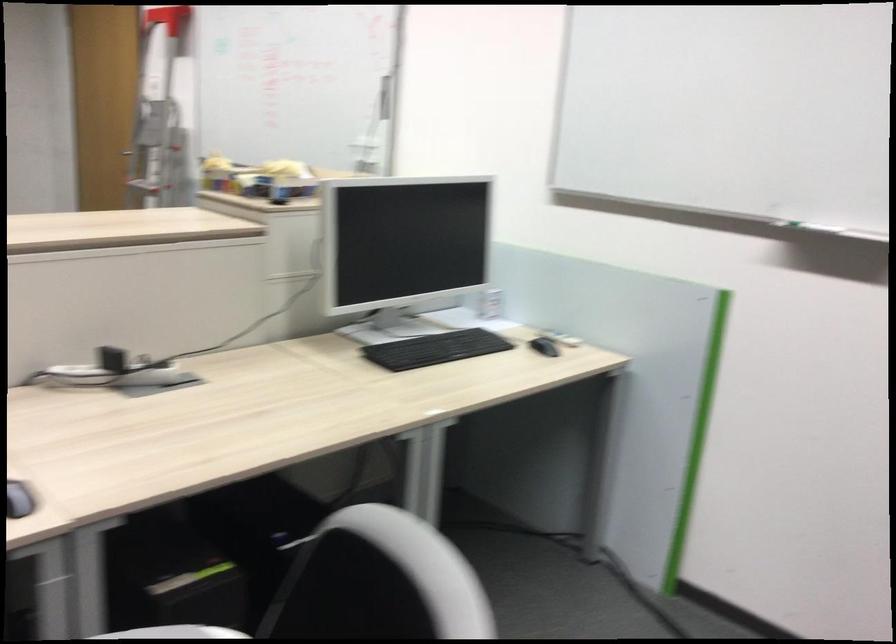
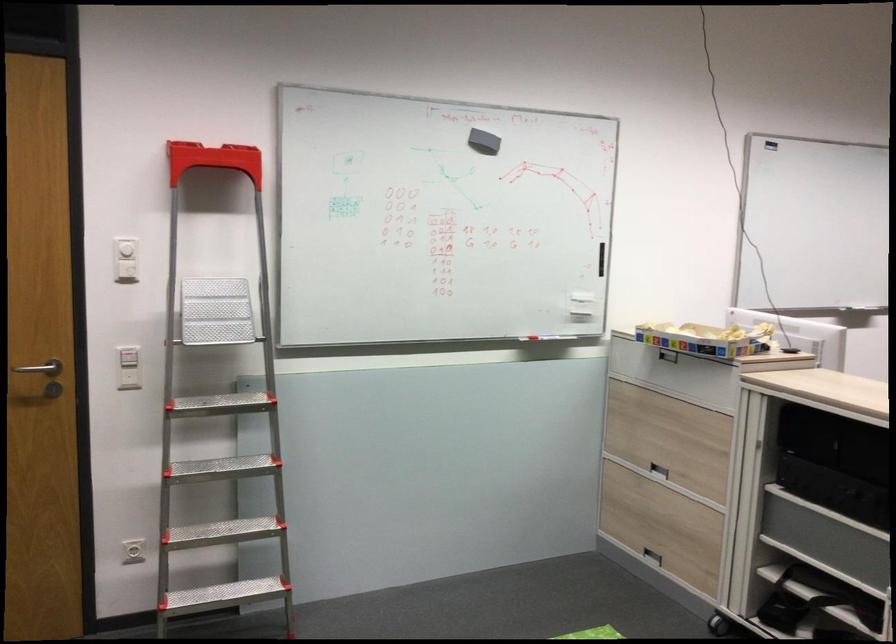
In the second image, find the point that corresponds to point 197,76 in the first image.

(125, 269)